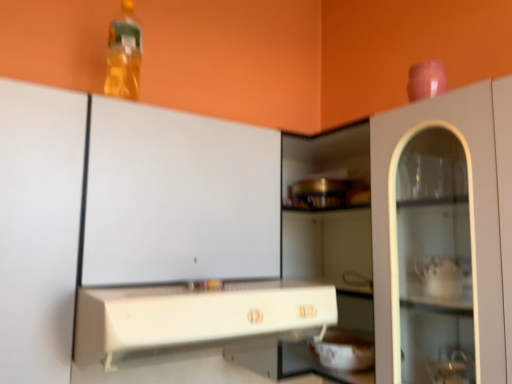
Question: From a real-world perspective, is white glossy bowl at lower center positioned under white plastic countertop at center based on gravity?

Choices:
 (A) yes
 (B) no

Answer: (A)

Question: Does white glossy bowl at lower center have a larger size compared to white plastic countertop at center?

Choices:
 (A) no
 (B) yes

Answer: (A)

Question: Would you say white plastic countertop at center is part of white glossy bowl at lower center's contents?

Choices:
 (A) no
 (B) yes

Answer: (A)

Question: Considering the relative sizes of white glossy bowl at lower center and white plastic countertop at center in the image provided, is white glossy bowl at lower center thinner than white plastic countertop at center?

Choices:
 (A) no
 (B) yes

Answer: (B)

Question: Is white glossy bowl at lower center wider than white plastic countertop at center?

Choices:
 (A) no
 (B) yes

Answer: (A)

Question: Based on their sizes in the image, would you say white glossy bowl at lower center is bigger or smaller than translucent plastic bottle at upper left?

Choices:
 (A) big
 (B) small

Answer: (B)

Question: Considering the positions of white glossy bowl at lower center and translucent plastic bottle at upper left in the image, is white glossy bowl at lower center wider or thinner than translucent plastic bottle at upper left?

Choices:
 (A) wide
 (B) thin

Answer: (A)

Question: From the image's perspective, is white glossy bowl at lower center above or below translucent plastic bottle at upper left?

Choices:
 (A) above
 (B) below

Answer: (B)

Question: Is white glossy bowl at lower center in front of or behind translucent plastic bottle at upper left in the image?

Choices:
 (A) front
 (B) behind

Answer: (B)

Question: Is white glossy bowl at lower center in front of or behind white plastic countertop at center in the image?

Choices:
 (A) front
 (B) behind

Answer: (B)

Question: Is white glossy bowl at lower center taller or shorter than white plastic countertop at center?

Choices:
 (A) short
 (B) tall

Answer: (A)

Question: In terms of size, does white glossy bowl at lower center appear bigger or smaller than white plastic countertop at center?

Choices:
 (A) small
 (B) big

Answer: (A)

Question: In terms of width, does white glossy bowl at lower center look wider or thinner when compared to white plastic countertop at center?

Choices:
 (A) wide
 (B) thin

Answer: (B)

Question: Is point (133, 97) closer or farther from the camera than point (352, 359)?

Choices:
 (A) closer
 (B) farther

Answer: (B)

Question: Is translucent plastic bottle at upper left bigger or smaller than white glossy bowl at lower center?

Choices:
 (A) small
 (B) big

Answer: (B)